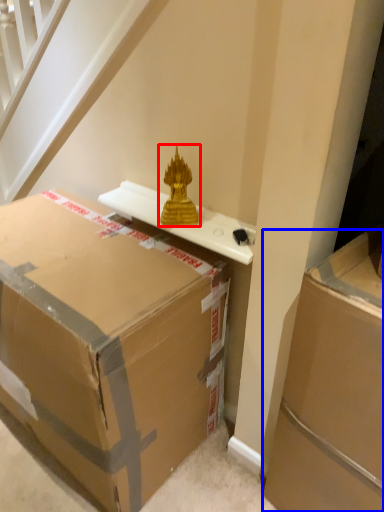
Question: Which object is further to the camera taking this photo, sculpture (highlighted by a red box) or box (highlighted by a blue box)?

Choices:
 (A) sculpture
 (B) box

Answer: (A)